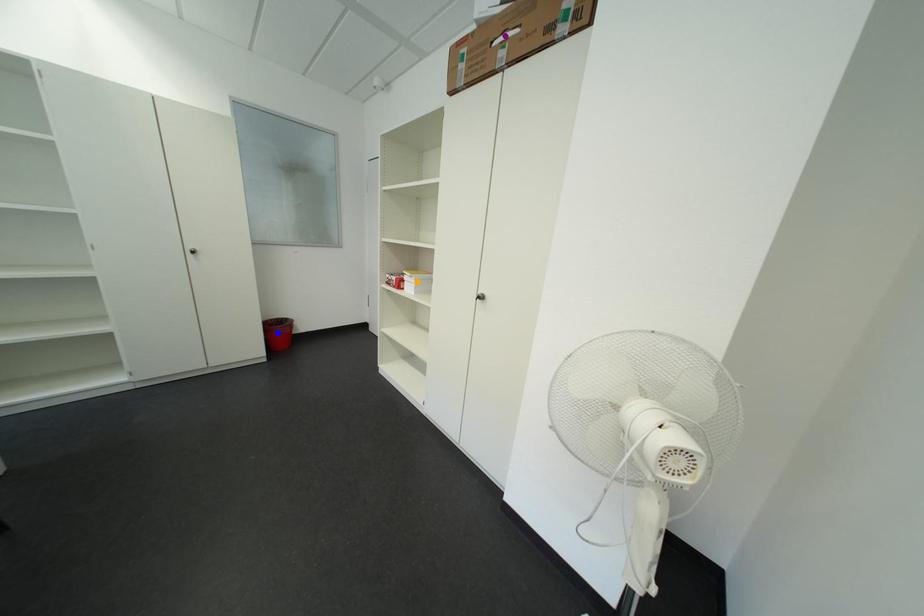
Order these from nearest to farthest:
A) orange point
B) purple point
C) blue point

1. purple point
2. orange point
3. blue point